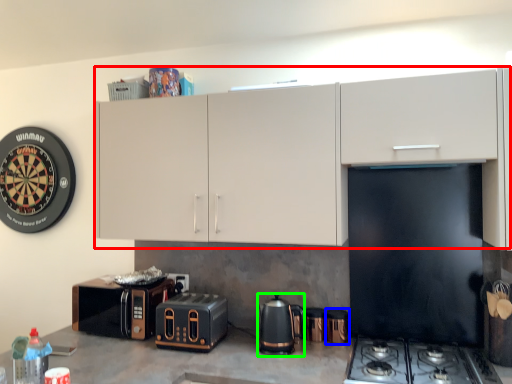
Question: Which is nearer to the cabinetry (highlighted by a red box)? appliance (highlighted by a blue box) or kitchen appliance (highlighted by a green box).

Choices:
 (A) appliance
 (B) kitchen appliance

Answer: (B)